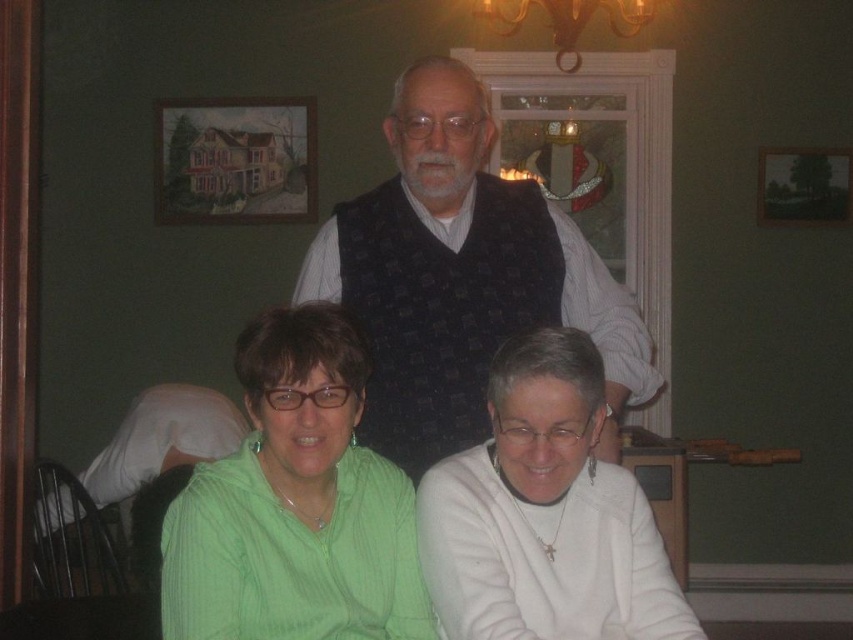
Question: Which of the following is the farthest from the observer?

Choices:
 (A) click(483, 212)
 (B) click(393, 570)

Answer: (A)

Question: Is the position of dark blue textured vest at center more distant than that of green matte shirt at lower left?

Choices:
 (A) yes
 (B) no

Answer: (A)

Question: Does dark blue textured vest at center come behind green matte shirt at lower left?

Choices:
 (A) no
 (B) yes

Answer: (B)

Question: Is dark blue textured vest at center below green matte shirt at lower left?

Choices:
 (A) yes
 (B) no

Answer: (B)